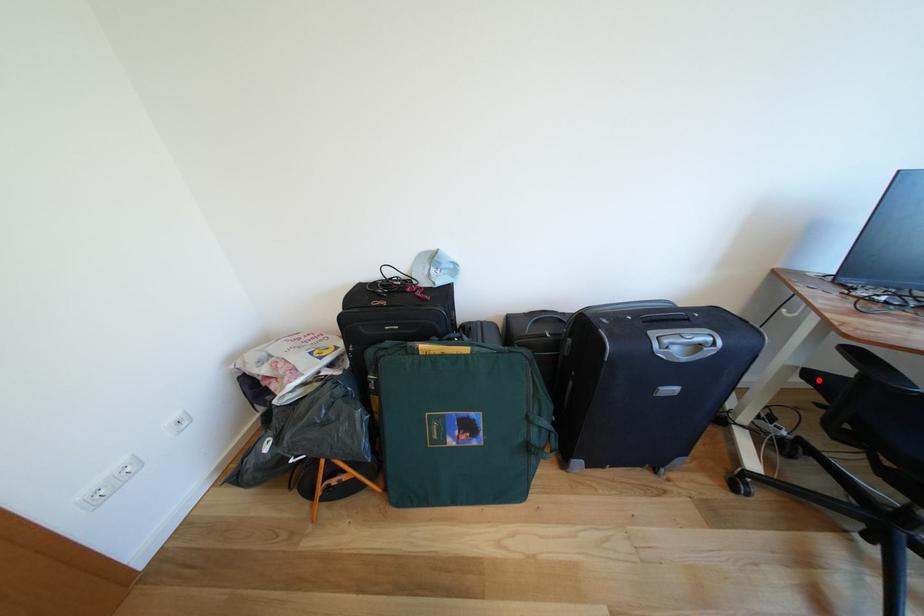
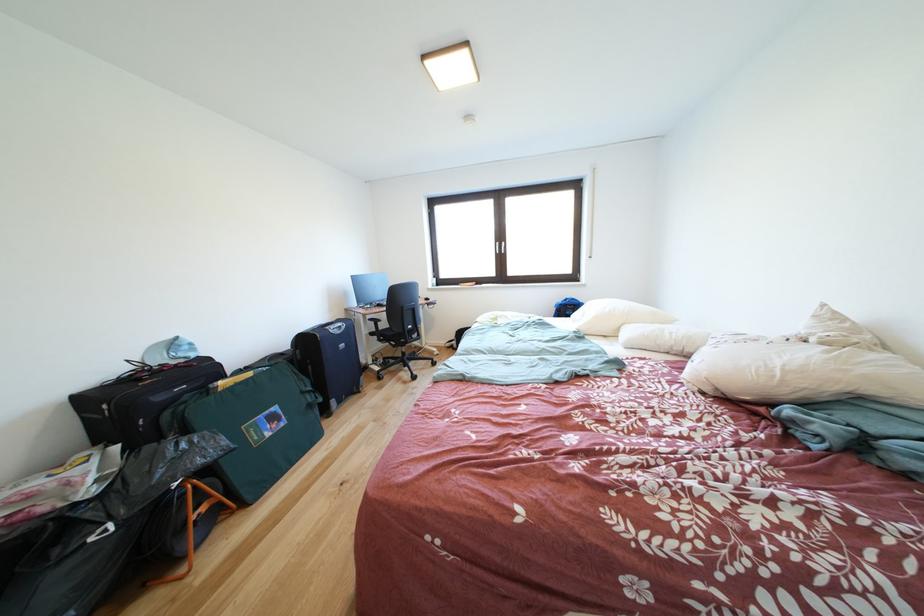
Where in the second image is the point corresponding to the highlighted location from the first image?

(380, 339)